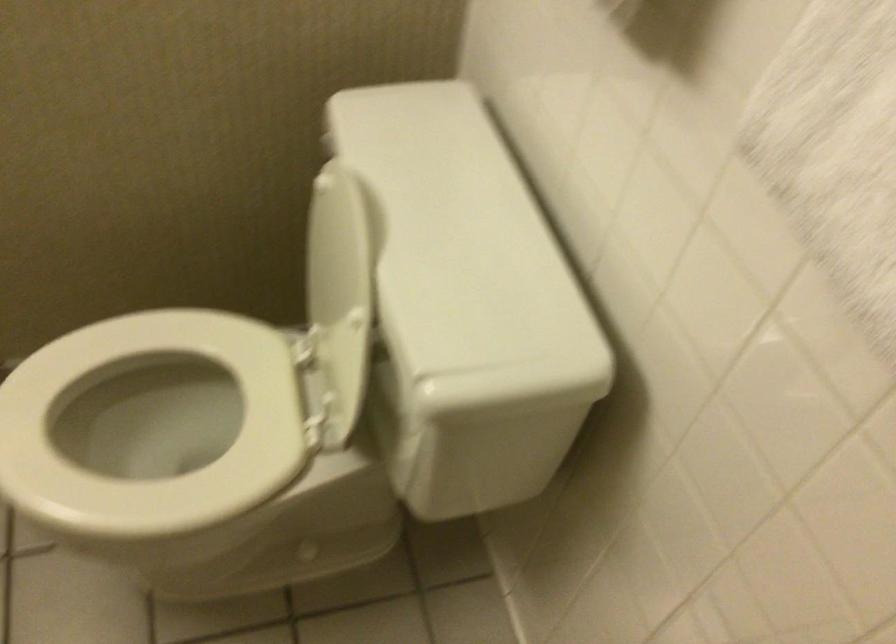
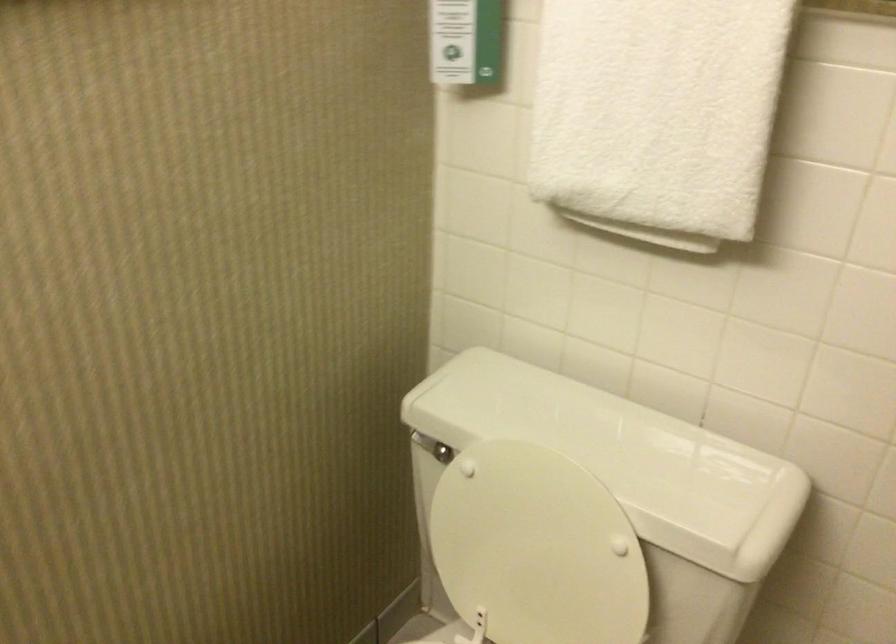
Locate, in the second image, the point that corresponds to (337,147) in the first image.

(425, 444)